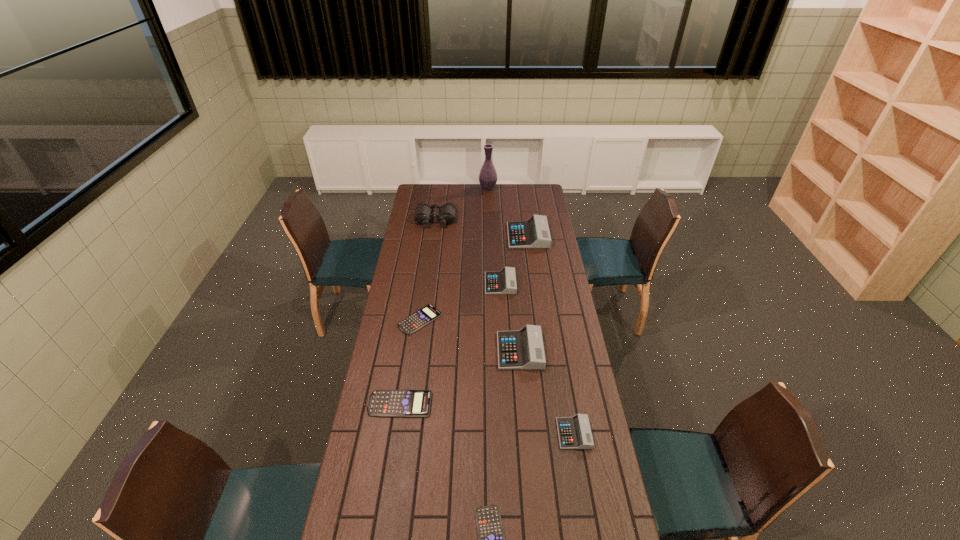
Find the location of a particular element. Image resolution: width=960 pixels, height=540 pixels. the sixth tallest object is located at coordinates (574, 432).

Identify the location of the biggest blue calculator. (384, 403).

Locate an element on the screen. The width and height of the screenshot is (960, 540). the seventh farthest object is located at coordinates (384, 403).

Identify the location of the second biggest blue calculator. (417, 320).

Where is `the second shortest calculator`? the second shortest calculator is located at coordinates (417, 320).

This screenshot has height=540, width=960. Identify the location of blank space located on the left of the tallest object. (452, 188).

Locate an element on the screen. The width and height of the screenshot is (960, 540). free space located 0.070m through the eyepieces of the eighth shortest object is located at coordinates (434, 237).

Locate an element on the screen. free spot located 0.220m on the front of the biggest gray calculator is located at coordinates (534, 276).

The image size is (960, 540). I want to click on free location located 0.110m on the left of the second tallest calculator, so click(471, 351).

Where is `vacant region located on the front of the fifth shortest calculator`? vacant region located on the front of the fifth shortest calculator is located at coordinates (503, 333).